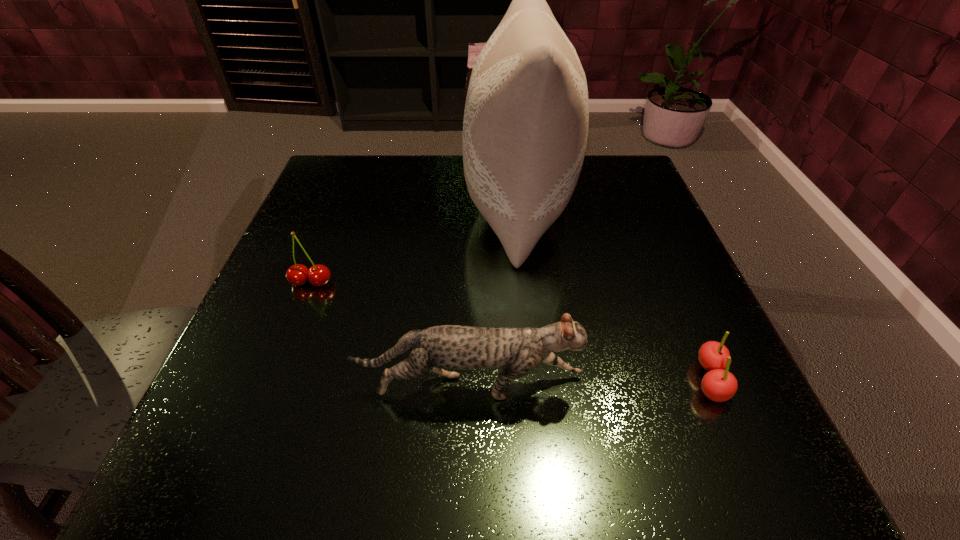
Locate an element on the screen. free spot between the left cherry and the cushion is located at coordinates (415, 244).

You are a GUI agent. You are given a task and a screenshot of the screen. Output one action in this format:
    pyautogui.click(x=<x>, y=<y>)
    Task: Click on the unoccupied position between the third shortest object and the cushion
    
    Given the screenshot: What is the action you would take?
    pyautogui.click(x=494, y=296)

Image resolution: width=960 pixels, height=540 pixels. Find the location of `free spot between the right cherry and the tallest object`. free spot between the right cherry and the tallest object is located at coordinates (613, 293).

The width and height of the screenshot is (960, 540). What are the coordinates of `free point between the taller cherry and the third shortest object` in the screenshot? It's located at (391, 334).

Find the location of a particular element. free space between the farther cherry and the tallest object is located at coordinates (415, 244).

In order to click on vacant area between the third shortest object and the right cherry in this screenshot , I will do `click(590, 383)`.

Locate an element on the screen. This screenshot has width=960, height=540. empty space that is in between the third shortest object and the tallest object is located at coordinates (494, 296).

This screenshot has width=960, height=540. In order to click on vacant point located between the taller cherry and the third shortest object in this screenshot , I will do `click(391, 334)`.

This screenshot has width=960, height=540. Identify the location of free area in between the cushion and the nearer cherry. (613, 293).

What are the coordinates of `object that stands as the third closest to the nearer cherry` in the screenshot? It's located at (319, 275).